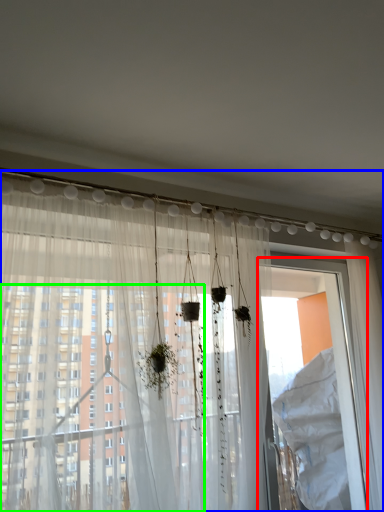
Question: Considering the real-world distances, which object is farthest from screen door (highlighted by a red box)? curtain (highlighted by a blue box) or window (highlighted by a green box)?

Choices:
 (A) curtain
 (B) window

Answer: (B)